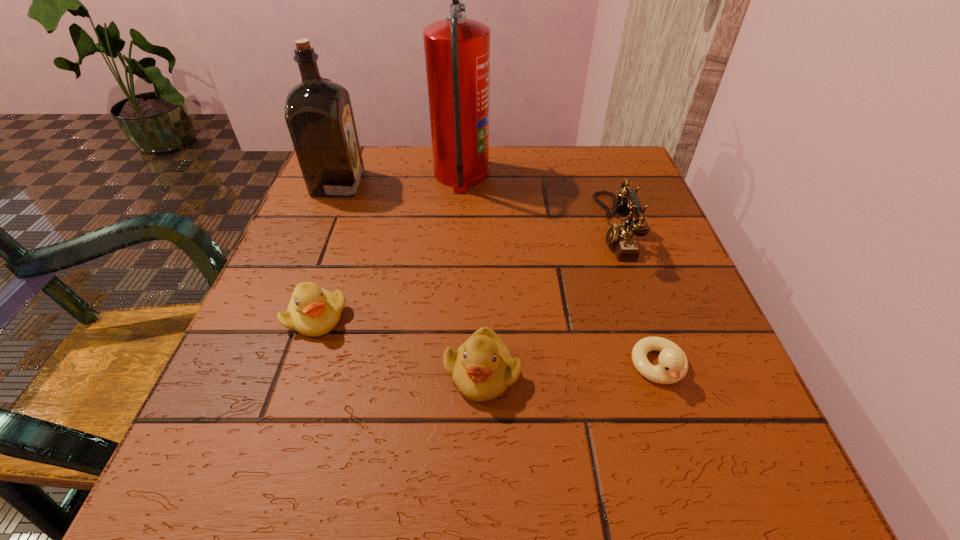
At what (x,y) coordinates should I click in order to perform the action: click on object that is the fifth closest to the second tallest object. Please return your answer as a coordinate pair (x, y). Looking at the image, I should click on (673, 365).

Choose which duckling is the second nearest neighbor to the second duckling from left to right. Please provide its 2D coordinates. Your answer should be formatted as a tuple, i.e. [(x, y)], where the tuple contains the x and y coordinates of a point satisfying the conditions above.

[(673, 365)]

Locate an element on the screen. Image resolution: width=960 pixels, height=540 pixels. the closest duckling to the farthest duckling is located at coordinates (482, 368).

The height and width of the screenshot is (540, 960). I want to click on free space that satisfies the following two spatial constraints: 1. on the front-facing side of the telephone; 2. at the beak of the shortest object, so click(x=660, y=367).

I want to click on free space that satisfies the following two spatial constraints: 1. on the instruction side of the fire extinguisher; 2. on the beak of the farthest duckling, so click(x=453, y=317).

Where is `vacant space that satisfies the following two spatial constraints: 1. on the front-facing side of the telephone; 2. on the front-facing side of the second duckling from left to right`? The width and height of the screenshot is (960, 540). vacant space that satisfies the following two spatial constraints: 1. on the front-facing side of the telephone; 2. on the front-facing side of the second duckling from left to right is located at coordinates (661, 373).

Locate an element on the screen. The width and height of the screenshot is (960, 540). vacant area in the image that satisfies the following two spatial constraints: 1. on the instruction side of the tallest object; 2. on the beak of the farthest duckling is located at coordinates (453, 317).